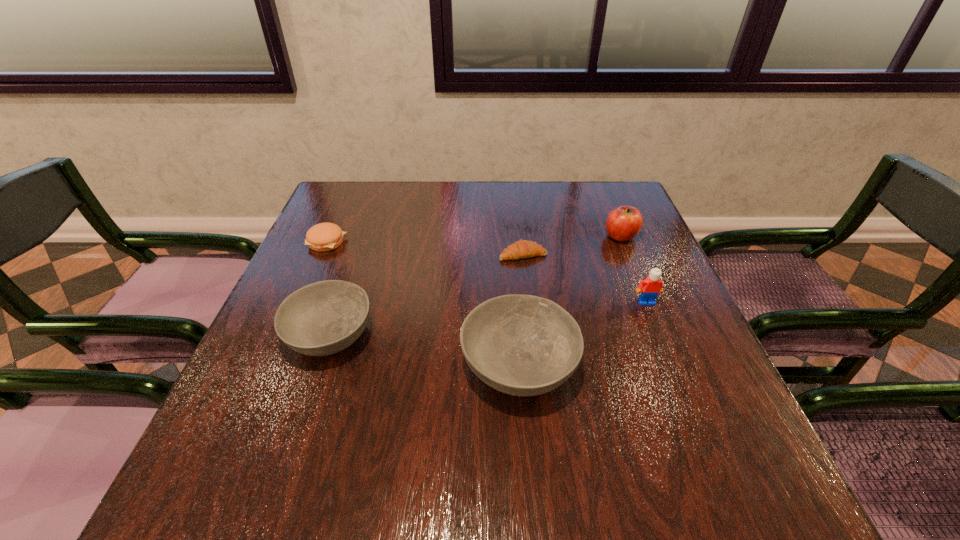
Where is `the fourth tallest object`? This screenshot has width=960, height=540. the fourth tallest object is located at coordinates (323, 318).

This screenshot has width=960, height=540. In order to click on the left bowl in this screenshot , I will do `click(323, 318)`.

The image size is (960, 540). I want to click on the taller bowl, so click(x=523, y=345).

I want to click on the shortest object, so (x=520, y=249).

Where is `Lego`? The height and width of the screenshot is (540, 960). Lego is located at coordinates pyautogui.click(x=651, y=286).

This screenshot has height=540, width=960. What are the coordinates of `apple` in the screenshot? It's located at [623, 223].

Identify the location of the fifth tallest object. Image resolution: width=960 pixels, height=540 pixels. (321, 237).

The height and width of the screenshot is (540, 960). I want to click on free space located on the front of the left bowl, so click(297, 435).

You are a GUI agent. You are given a task and a screenshot of the screen. Output one action in this format:
    pyautogui.click(x=<x>, y=<y>)
    Task: Click on the blank space located on the back of the taller bowl
    
    Given the screenshot: What is the action you would take?
    pyautogui.click(x=509, y=247)

Where is `vacant position located 0.100m on the left of the crescent roll`? vacant position located 0.100m on the left of the crescent roll is located at coordinates (460, 254).